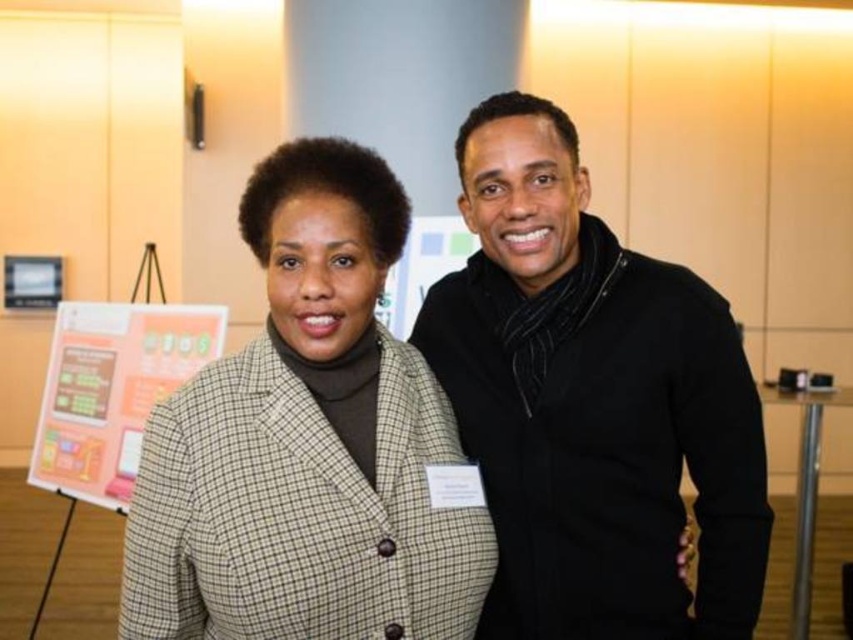
You are at a conference and need to position two name tags on a display board. The first name tag corresponds to the point at coordinates point (527, 250) and the second to point (323, 324). If you want to place them so that one is behind the other, which point should be placed further back?

Point (527, 250) should be placed further back because it is behind point (323, 324) according to the description.